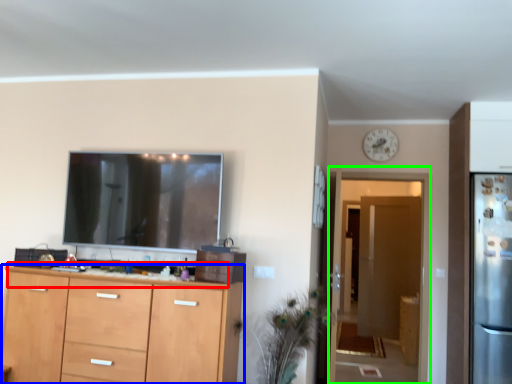
Question: Estimate the real-world distances between objects in this image. Which object is closer to counter top (highlighted by a red box), cabinetry (highlighted by a blue box) or glass door (highlighted by a green box)?

Choices:
 (A) cabinetry
 (B) glass door

Answer: (A)